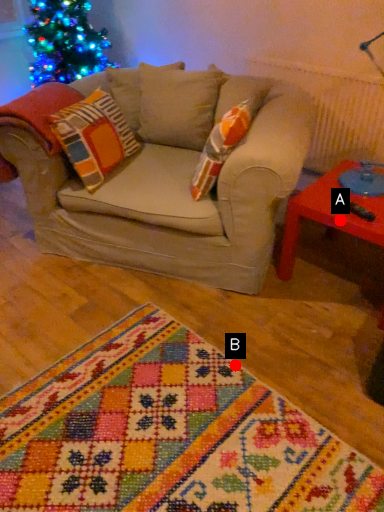
Question: Two points are circled on the image, labeled by A and B beside each circle. Among these points, which one is farthest from the camera?

Choices:
 (A) A is further
 (B) B is further

Answer: (A)